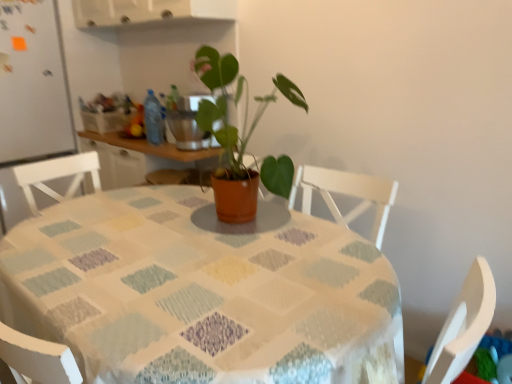
Question: Is blue plastic bottle at center oriented away from white matte refrigerator at left?

Choices:
 (A) yes
 (B) no

Answer: (B)

Question: From a real-world perspective, is blue plastic bottle at center below white matte refrigerator at left?

Choices:
 (A) no
 (B) yes

Answer: (A)

Question: Is white matte refrigerator at left surrounded by blue plastic bottle at center?

Choices:
 (A) no
 (B) yes

Answer: (A)

Question: From a real-world perspective, is blue plastic bottle at center positioned over white matte refrigerator at left based on gravity?

Choices:
 (A) yes
 (B) no

Answer: (A)

Question: Considering the relative positions of blue plastic bottle at center and white matte refrigerator at left in the image provided, is blue plastic bottle at center behind white matte refrigerator at left?

Choices:
 (A) no
 (B) yes

Answer: (B)

Question: Does blue plastic bottle at center appear on the right side of white matte refrigerator at left?

Choices:
 (A) yes
 (B) no

Answer: (A)

Question: From the image's perspective, does white matte refrigerator at left appear higher than textured fabric tablecloth at center?

Choices:
 (A) no
 (B) yes

Answer: (B)

Question: From a real-world perspective, is white matte refrigerator at left physically above textured fabric tablecloth at center?

Choices:
 (A) yes
 (B) no

Answer: (A)

Question: Considering the relative positions of white matte refrigerator at left and textured fabric tablecloth at center in the image provided, is white matte refrigerator at left to the right of textured fabric tablecloth at center from the viewer's perspective?

Choices:
 (A) no
 (B) yes

Answer: (A)

Question: Considering the relative sizes of white matte refrigerator at left and textured fabric tablecloth at center in the image provided, is white matte refrigerator at left smaller than textured fabric tablecloth at center?

Choices:
 (A) yes
 (B) no

Answer: (A)

Question: Is white matte refrigerator at left shorter than textured fabric tablecloth at center?

Choices:
 (A) no
 (B) yes

Answer: (A)

Question: Does white matte refrigerator at left turn towards textured fabric tablecloth at center?

Choices:
 (A) no
 (B) yes

Answer: (B)

Question: Is matte terracotta pot at center outside of textured fabric tablecloth at center?

Choices:
 (A) no
 (B) yes

Answer: (B)